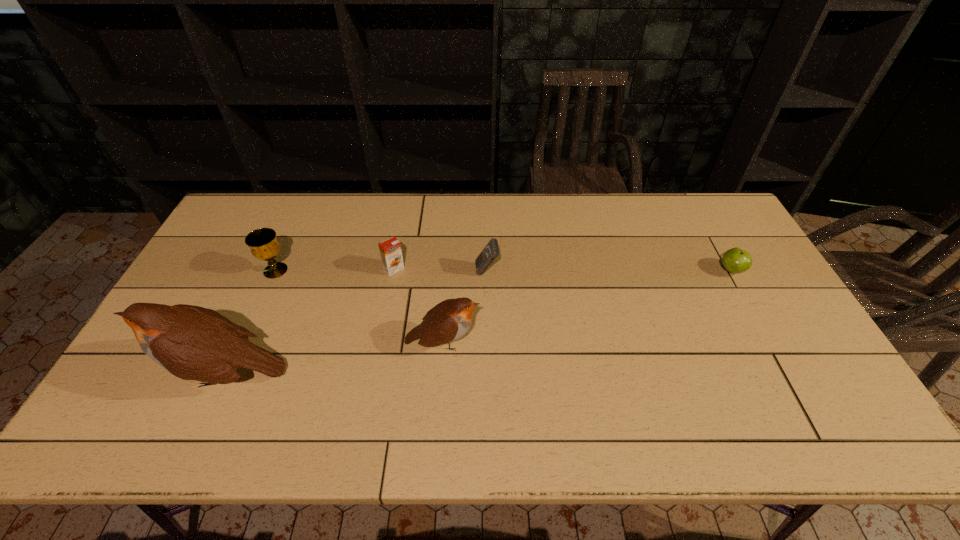
Identify the location of object that is at the right edge. (735, 260).

The width and height of the screenshot is (960, 540). I want to click on object located at the near left corner, so click(x=193, y=343).

Locate an element on the screen. free space at the far edge of the desktop is located at coordinates click(551, 231).

I want to click on free spot at the near edge of the desktop, so click(x=493, y=378).

Image resolution: width=960 pixels, height=540 pixels. In the image, there is a desktop. Identify the location of vacant space at the left edge. (235, 244).

I want to click on free space at the right edge, so click(x=720, y=265).

Where is `vacant area at the far left corner of the desktop`? This screenshot has height=540, width=960. vacant area at the far left corner of the desktop is located at coordinates (236, 210).

Locate an element on the screen. This screenshot has height=540, width=960. vacant point at the far right corner is located at coordinates (712, 209).

The image size is (960, 540). In order to click on vacant area that lies between the third object from left to right and the right bird in this screenshot , I will do `click(419, 306)`.

Where is `empty location between the second tallest object and the taller bird`? This screenshot has height=540, width=960. empty location between the second tallest object and the taller bird is located at coordinates (335, 358).